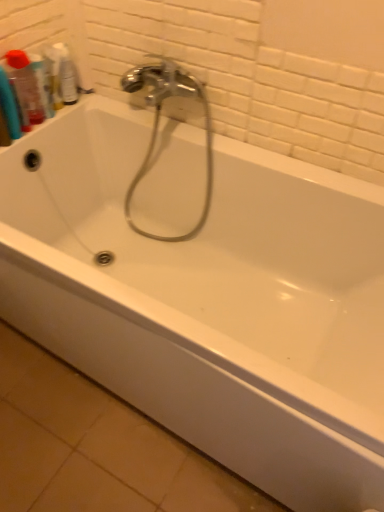
The width and height of the screenshot is (384, 512). I want to click on free location to the right of clear plastic bottle at upper left, which is counted as the 3th mouthwash, starting from the left, so click(115, 99).